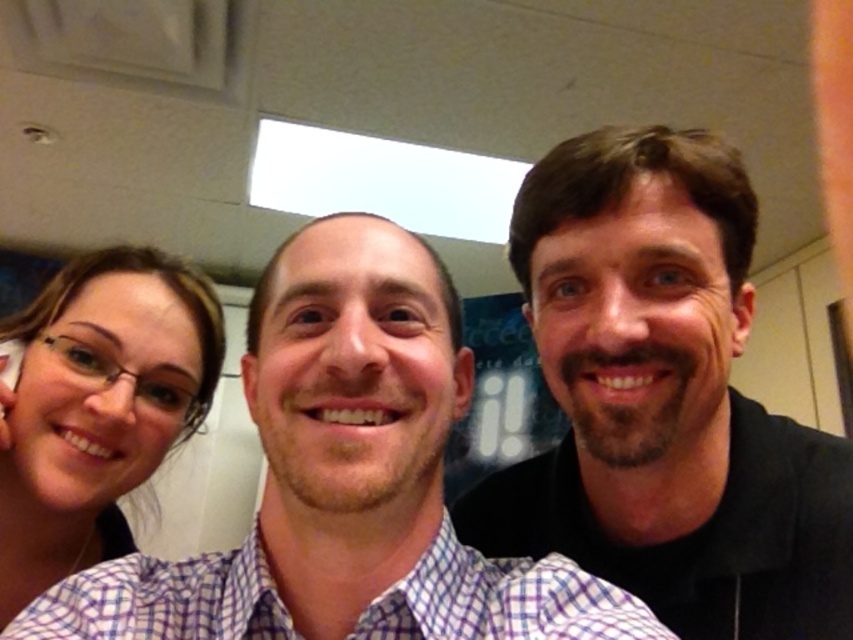
Consider the image. Can you confirm if smooth black shirt at right is shorter than matte purple shirt at left?

In fact, smooth black shirt at right may be taller than matte purple shirt at left.

Is smooth black shirt at right in front of matte purple shirt at left?

Yes, smooth black shirt at right is in front of matte purple shirt at left.

Which is in front, point (653, 561) or point (99, 256)?

Point (653, 561) is in front.

The height and width of the screenshot is (640, 853). Identify the location of smooth black shirt at right. (663, 401).